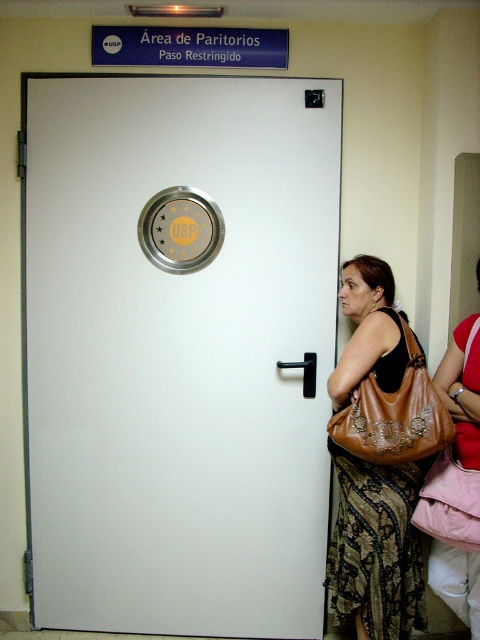
You are a healthcare worker needing to enter the restricted delivery area. You are currently holding your medical bag and standing 18 inches away from the white glossy door at center. There is a brown leather purse at right nearby. Can you reach the door handle without moving your feet?

The distance between the white glossy door at center and the brown leather purse at right is 21.16 inches. Since you are only 18 inches away from the door, you are close enough to reach the handle without moving your feet.

You are a delivery person trying to deliver a package to the restricted area. The door requires that the package must be smaller than the door. Your package is the same size as the brown leather bag at right. Can you deliver it through the white glossy door at center?

The white glossy door at center is wider than the brown leather bag at right, so yes, the package can be delivered through the white glossy door at center since it is smaller than the door.

You are a security guard at the delivery area. You need to check if the brown leather purse at right is within the restricted zone. The restricted zone extends 5 feet from the door. Is the purse within the restricted zone?

The brown leather purse at right is 6.27 feet away from the camera. Since the restricted zone extends 5 feet from the door, the purse is outside the restricted zone.